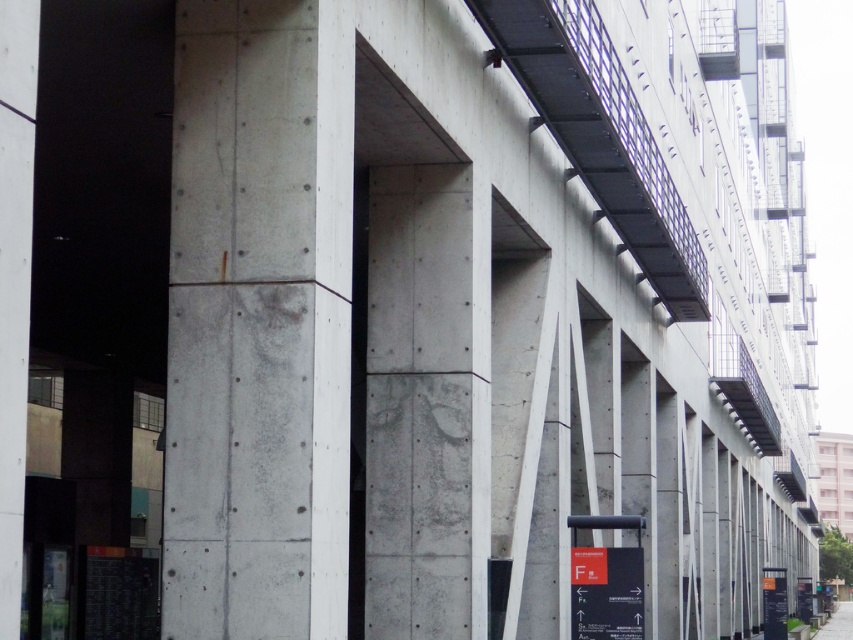
Question: Which object appears farthest from the camera in this image?

Choices:
 (A) gray concrete pillar at center
 (B) smooth black metal overpass at upper center

Answer: (B)

Question: Which object is positioned farthest from the gray concrete pavement at lower right?

Choices:
 (A) gray concrete pillar at center
 (B) smooth black metal overpass at upper center

Answer: (A)

Question: Is gray concrete pillar at center above gray concrete pavement at lower right?

Choices:
 (A) yes
 (B) no

Answer: (A)

Question: Which point appears closest to the camera in this image?

Choices:
 (A) (589, 156)
 (B) (828, 634)

Answer: (A)

Question: Does gray concrete pillar at center have a larger size compared to gray concrete pavement at lower right?

Choices:
 (A) no
 (B) yes

Answer: (A)

Question: Does gray concrete pillar at center appear under gray concrete pavement at lower right?

Choices:
 (A) no
 (B) yes

Answer: (A)